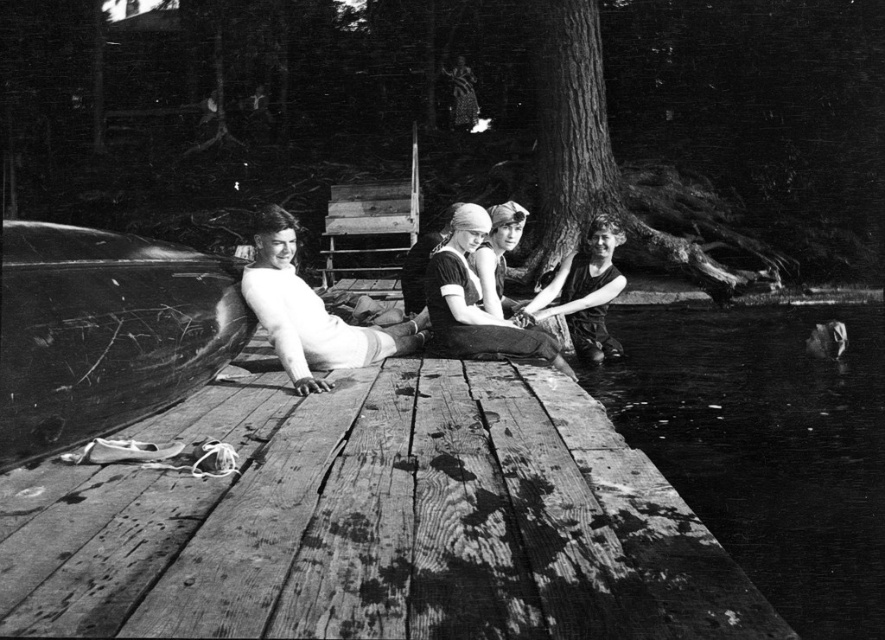
Question: Which object appears closest to the camera in this image?

Choices:
 (A) smooth white swim cap at center
 (B) weathered wood dock at center
 (C) matte black swimsuit at center

Answer: (B)

Question: From the image, what is the correct spatial relationship of dark water at lower right in relation to smooth white skin at center?

Choices:
 (A) below
 (B) above

Answer: (A)

Question: In this image, where is weathered wood dock at center located relative to smooth white swim cap at center?

Choices:
 (A) left
 (B) right

Answer: (A)

Question: Does smooth white skin at center have a greater width compared to smooth white swim cap at center?

Choices:
 (A) yes
 (B) no

Answer: (A)

Question: Based on their relative distances, which object is farther from the matte black swimsuit at center?

Choices:
 (A) dark water at lower right
 (B) dark fabric swimsuit at center
 (C) smooth white skin at center
 (D) weathered wood dock at center

Answer: (D)

Question: Which point appears farthest from the camera in this image?

Choices:
 (A) (440, 269)
 (B) (358, 339)
 (C) (52, 464)
 (D) (579, 259)

Answer: (D)